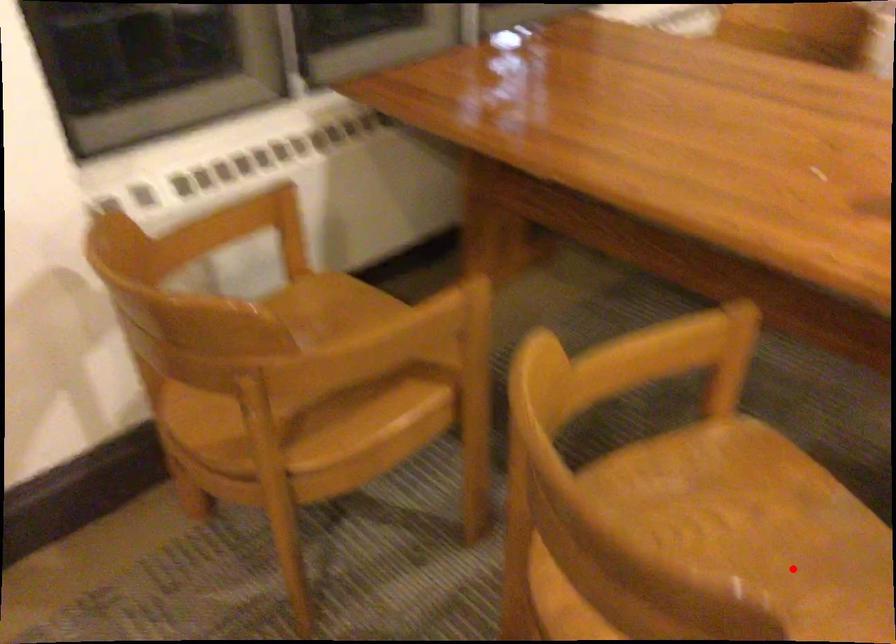
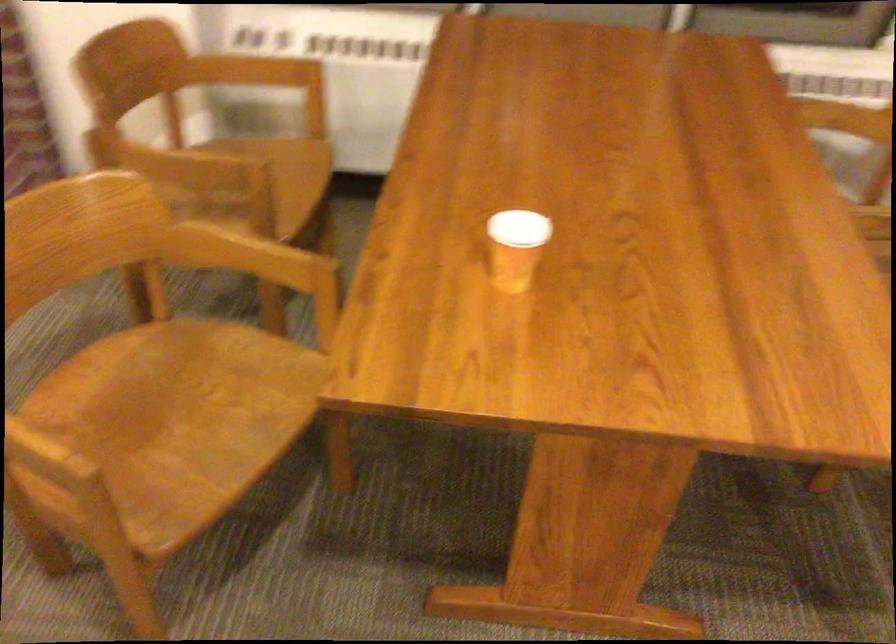
Question: A red point is marked in image1. In image2, is the corresponding 3D point closer to the camera or farther? Reply with the corresponding letter.

Choices:
 (A) The corresponding 3D point is closer.
 (B) The corresponding 3D point is farther.

Answer: (B)